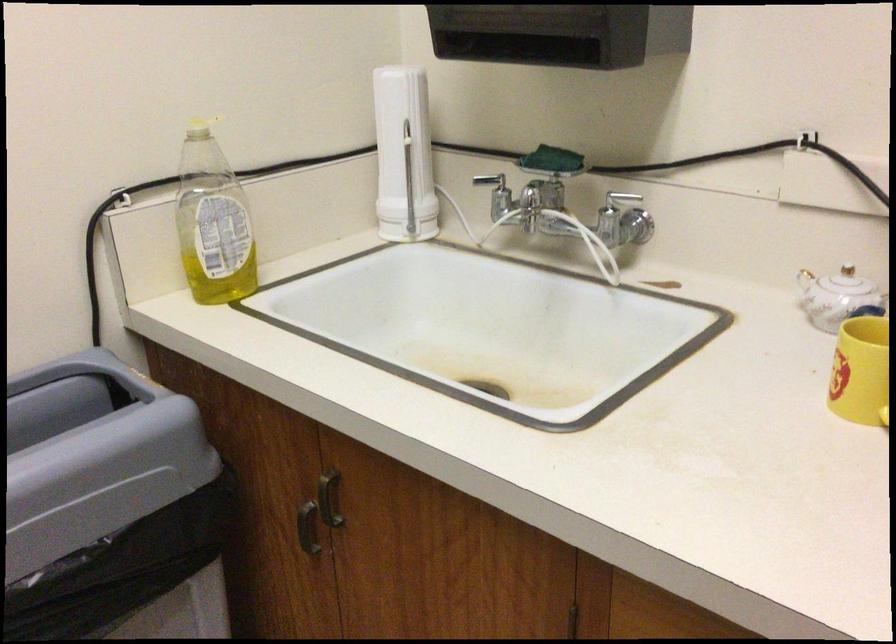
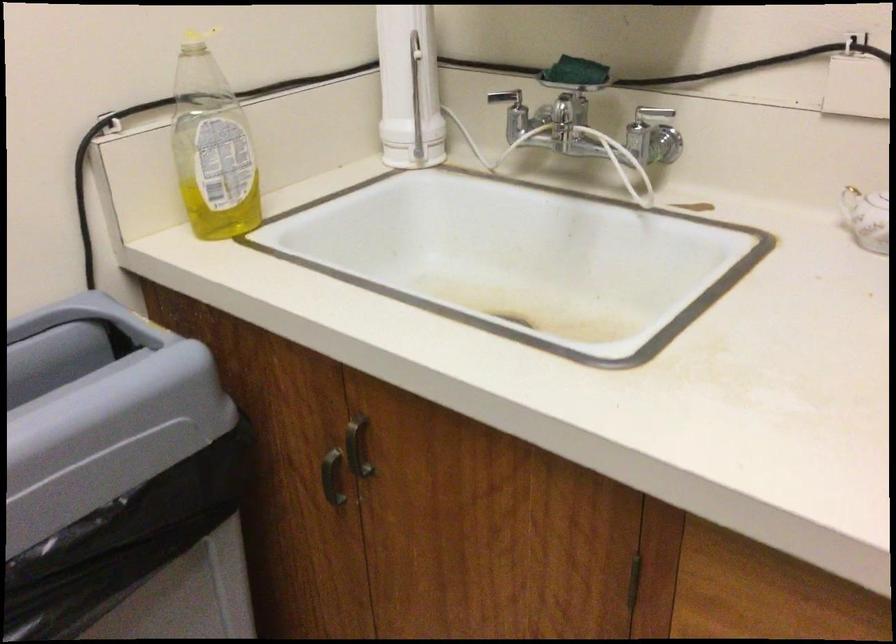
Question: The first image is from the beginning of the video and the second image is from the end. How did the camera likely rotate when shooting the video?

Choices:
 (A) Left
 (B) Right
 (C) Up
 (D) Down

Answer: (D)